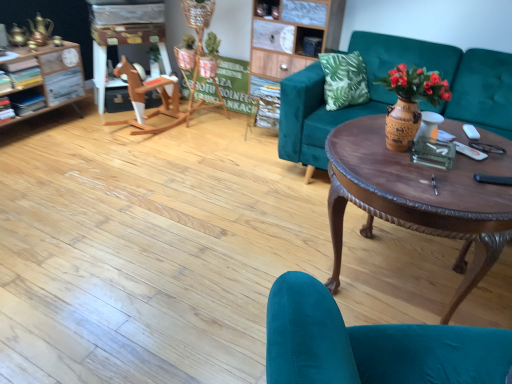
Locate an element on the screen. Image resolution: width=512 pixels, height=384 pixels. vacant space that is in between teal velvet chair at lower right and wooden rocking horse at left is located at coordinates (202, 219).